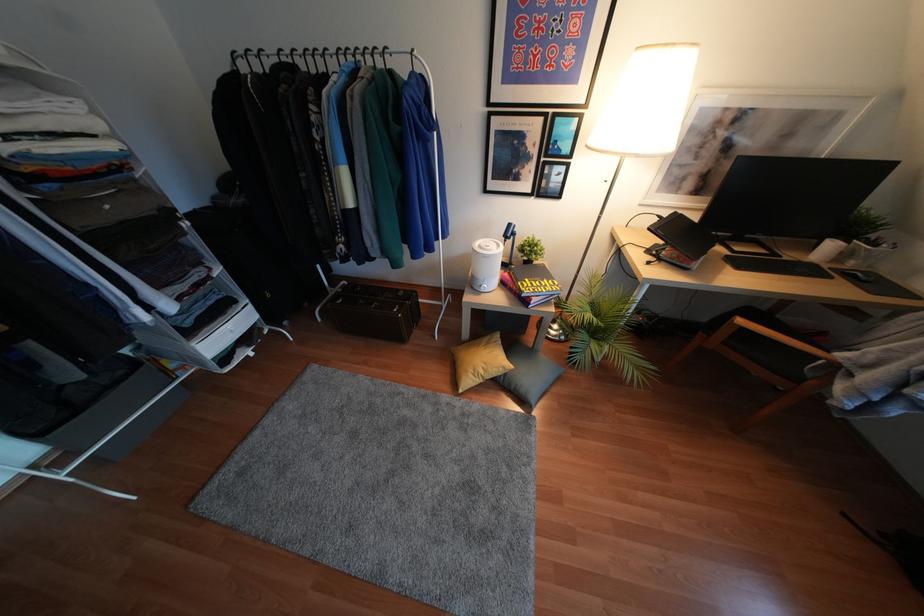
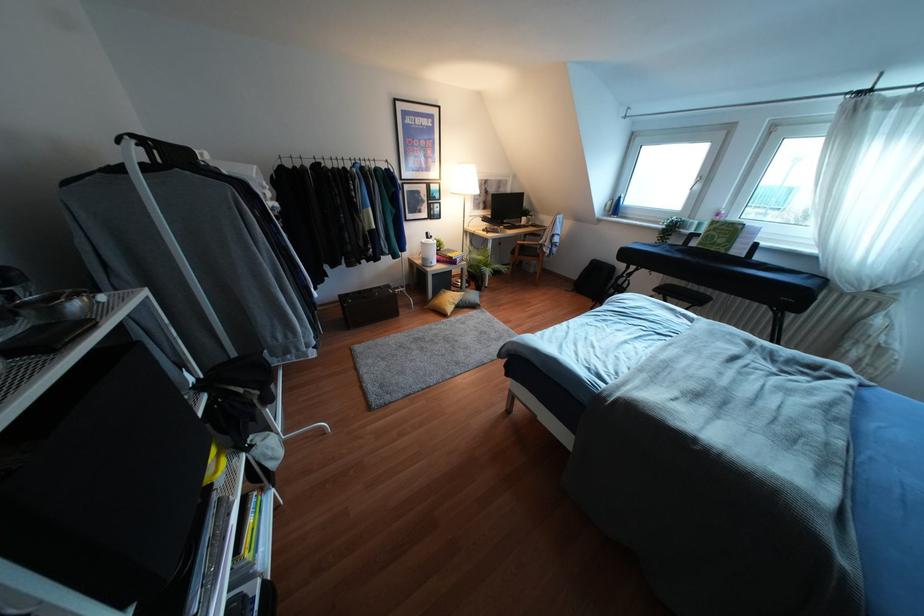
The point at (508,224) is marked in the first image. Where is the corresponding point in the second image?

(427, 233)